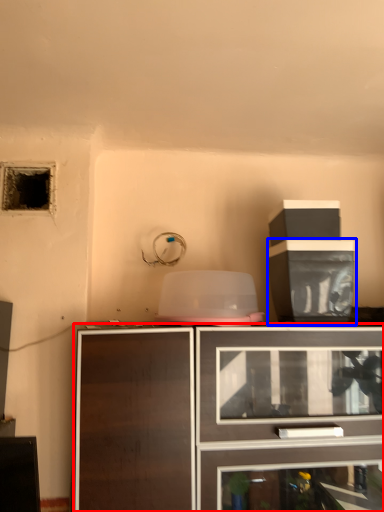
Question: Which point is further to the camera, cabinetry (highlighted by a red box) or cabinetry (highlighted by a blue box)?

Choices:
 (A) cabinetry
 (B) cabinetry

Answer: (B)